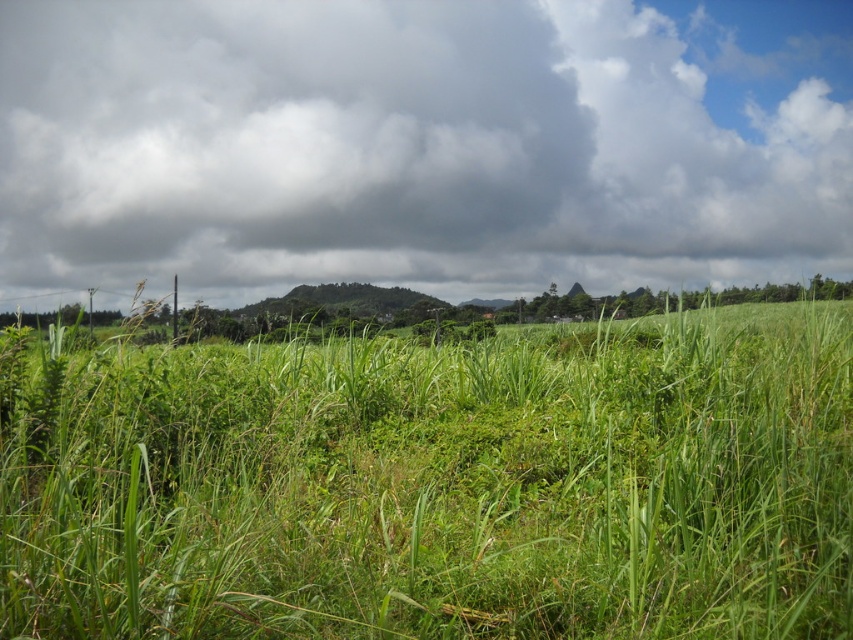
Question: Which point is closer to the camera?

Choices:
 (A) (184, 262)
 (B) (486, 524)

Answer: (B)

Question: In this image, where is green grassy field at center located relative to dark gray cloud at upper center?

Choices:
 (A) left
 (B) right

Answer: (B)

Question: In this image, where is green grassy field at center located relative to dark gray cloud at upper center?

Choices:
 (A) above
 (B) below

Answer: (B)

Question: Does green grassy field at center have a smaller size compared to dark gray cloud at upper center?

Choices:
 (A) yes
 (B) no

Answer: (A)